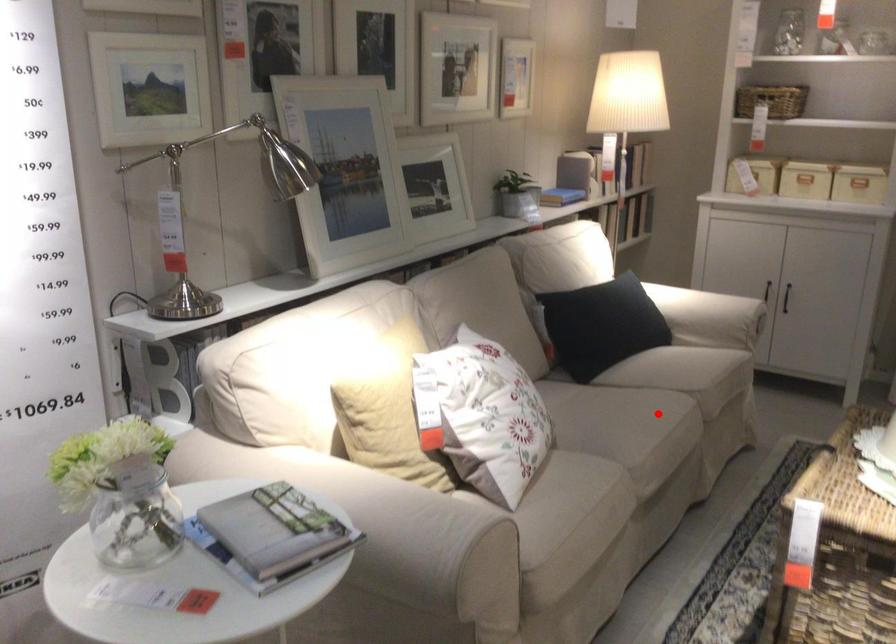
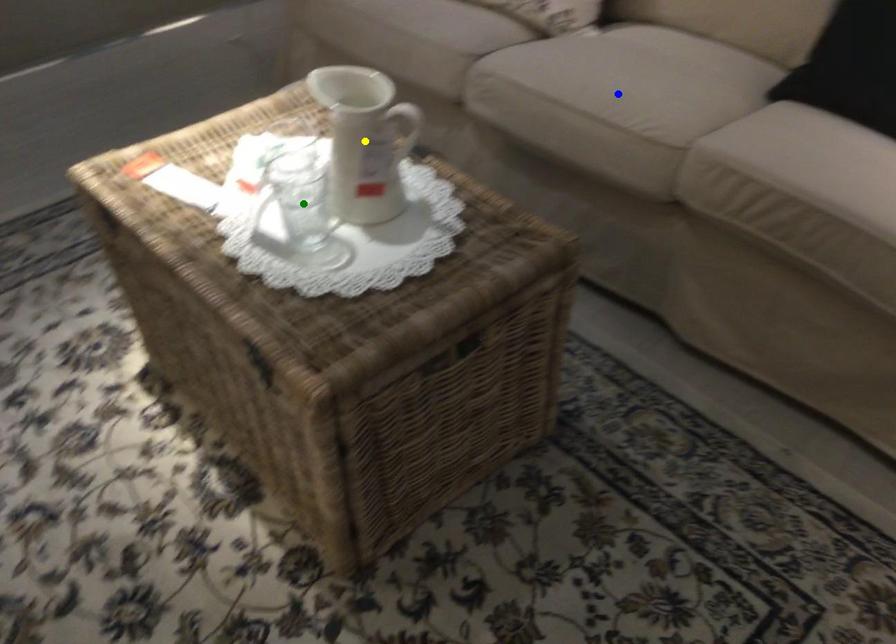
Question: I am providing you with two images of the same scene from different viewpoints. A red point is marked on the first image. You are given multiple points on the second image. In image 2, which mark is for the same physical point as the one in image 1?

Choices:
 (A) green point
 (B) yellow point
 (C) blue point

Answer: (C)